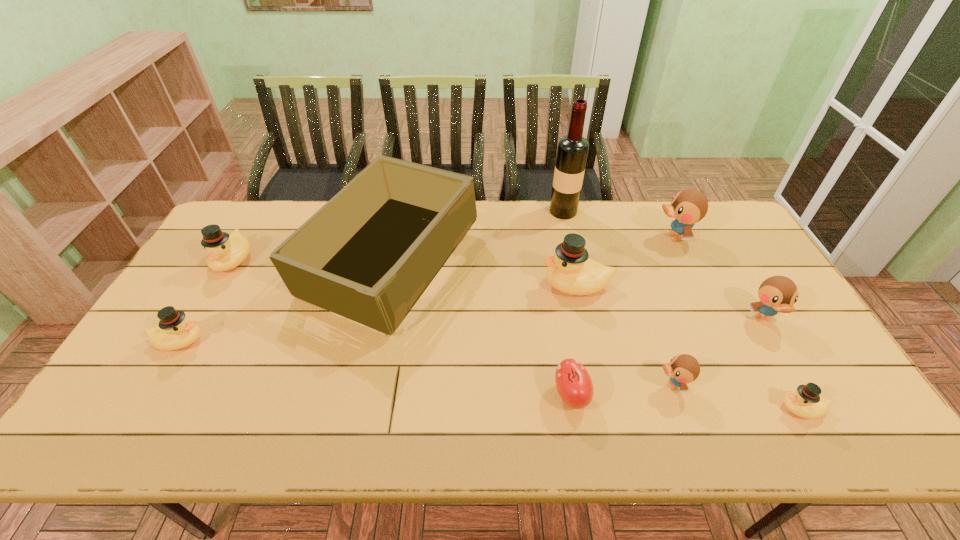
Where is `blue duck that stands as the closest to the biggest blue duck`? blue duck that stands as the closest to the biggest blue duck is located at coordinates (777, 294).

The image size is (960, 540). In order to click on yellow duck that stands as the third closest to the third farthest yellow duck in this screenshot , I will do `click(805, 402)`.

Find the location of a particular element. The width and height of the screenshot is (960, 540). yellow duck that can be found as the third closest to the apple is located at coordinates (174, 331).

Locate an element on the screen. free location that satisfies the following two spatial constraints: 1. on the front side of the brown box; 2. on the right side of the apple is located at coordinates (362, 396).

Find the location of a particular element. This screenshot has width=960, height=540. vacant space that satisfies the following two spatial constraints: 1. on the back side of the apple; 2. on the front-facing side of the second nearest yellow duck is located at coordinates (562, 341).

This screenshot has width=960, height=540. What are the coordinates of `free space in the image that satisfies the following two spatial constraints: 1. on the front-facing side of the rightmost blue duck; 2. on the front-facing side of the smallest yellow duck` in the screenshot? It's located at (816, 408).